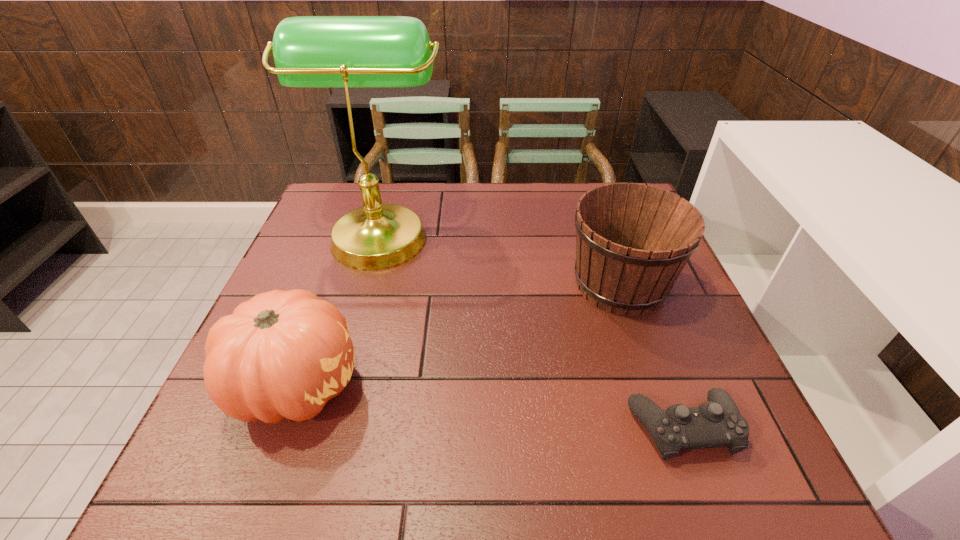
Locate an element on the screen. This screenshot has height=540, width=960. lamp is located at coordinates [x=309, y=51].

Identify the location of wine bucket. (632, 241).

Locate an element on the screen. The image size is (960, 540). pumpkin is located at coordinates (282, 354).

Image resolution: width=960 pixels, height=540 pixels. I want to click on control, so click(x=717, y=423).

Locate an element on the screen. The height and width of the screenshot is (540, 960). free spot located 0.140m on the desk next to the tallest object is located at coordinates (498, 232).

The width and height of the screenshot is (960, 540). Identify the location of vacant space located on the front of the wine bucket. (675, 444).

Locate an element on the screen. The width and height of the screenshot is (960, 540). vacant area situated 0.060m on the carved face of the pumpkin is located at coordinates (393, 384).

I want to click on free space located 0.110m on the back of the control, so click(x=655, y=349).

Find the location of `object positioned at the far edge`. object positioned at the far edge is located at coordinates (309, 51).

This screenshot has width=960, height=540. Find the location of `pumpkin at the near edge`. pumpkin at the near edge is located at coordinates (282, 354).